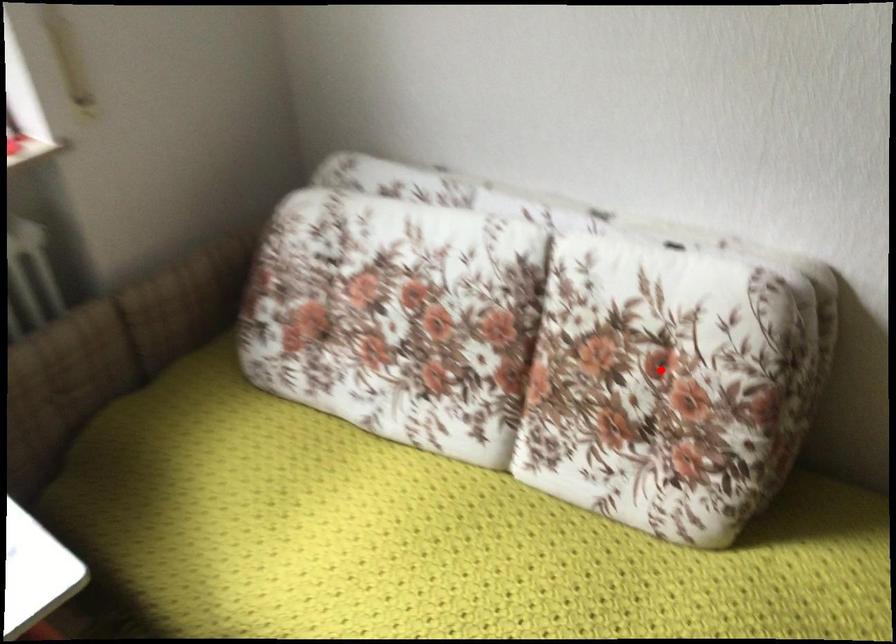
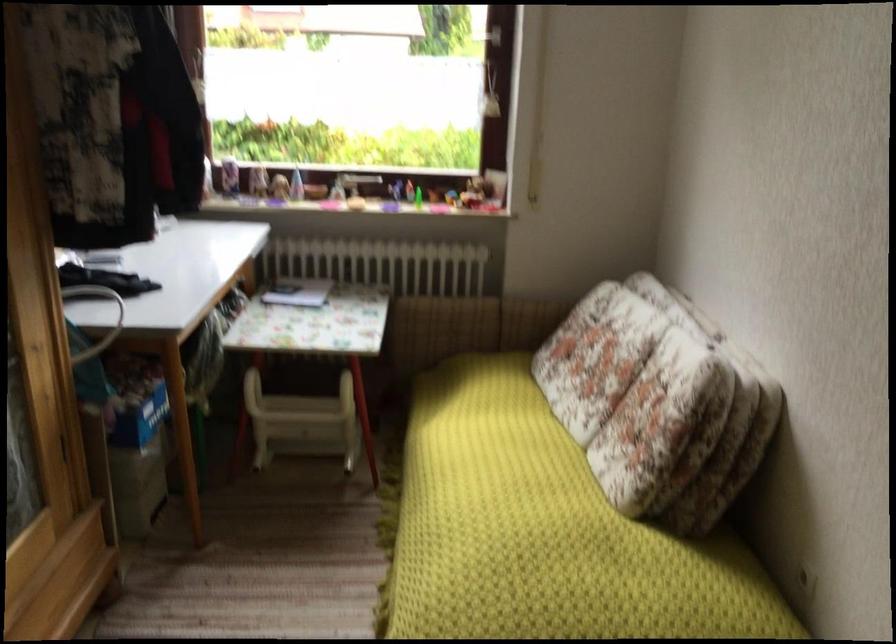
Question: I am providing you with two images of the same scene from different viewpoints. Given a red point in image1, look at the same physical point in image2. Is it:

Choices:
 (A) Closer to the viewpoint
 (B) Farther from the viewpoint

Answer: (B)